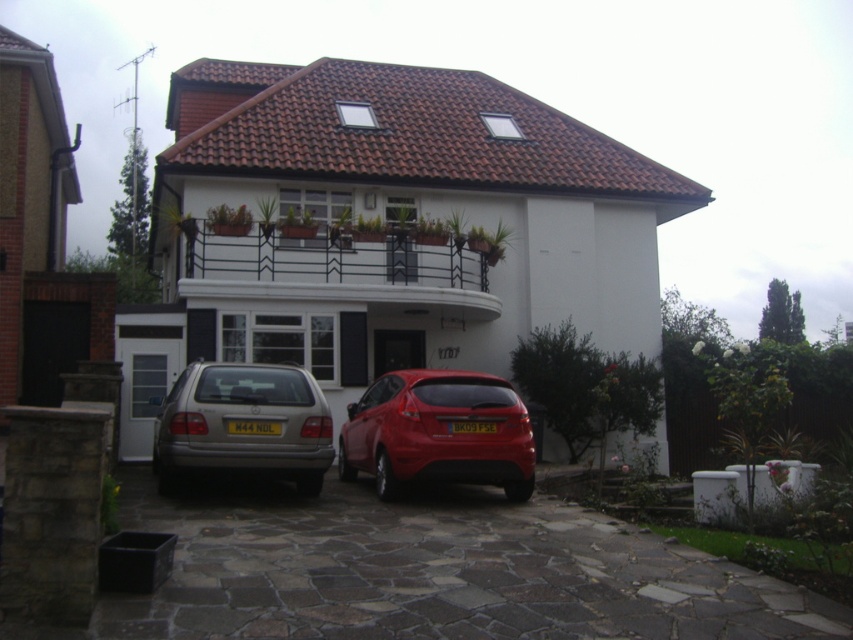
Is brown stone driveway at center above yellow matte license plate at center?

Actually, brown stone driveway at center is below yellow matte license plate at center.

This screenshot has height=640, width=853. Describe the element at coordinates (434, 572) in the screenshot. I see `brown stone driveway at center` at that location.

Is point (576, 624) behind point (277, 420)?

No, it is not.

Where is `brown stone driveway at center`? This screenshot has width=853, height=640. brown stone driveway at center is located at coordinates (x=434, y=572).

Which is more to the right, satin silver car at lower left or yellow matte license plate at center?

Positioned to the right is yellow matte license plate at center.

Is point (164, 481) less distant than point (244, 420)?

No, it is behind (244, 420).

Find the location of a particular element. This screenshot has height=640, width=853. satin silver car at lower left is located at coordinates pos(242,419).

Is glossy metallic hatchback at center to the right of yellow plastic license plate at center from the viewer's perspective?

Incorrect, glossy metallic hatchback at center is not on the right side of yellow plastic license plate at center.

Can you confirm if glossy metallic hatchback at center is thinner than yellow plastic license plate at center?

No.

Who is more distant from viewer, (461, 394) or (474, 420)?

The point (461, 394) is behind.

At what (x,y) coordinates should I click in order to perform the action: click on glossy metallic hatchback at center. Please return your answer as a coordinate pair (x, y). Looking at the image, I should click on (438, 433).